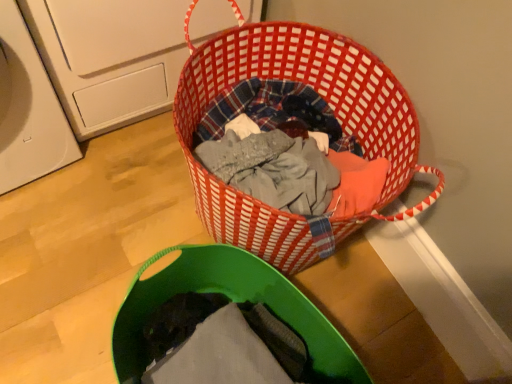
Question: From their relative heights in the image, would you say green fabric laundry basket at lower center is taller or shorter than red woven basket at center?

Choices:
 (A) tall
 (B) short

Answer: (B)

Question: Visually, is green fabric laundry basket at lower center positioned to the left or to the right of red woven basket at center?

Choices:
 (A) right
 (B) left

Answer: (B)

Question: Which object is the farthest from the red woven basket at center?

Choices:
 (A) green fabric laundry basket at lower center
 (B) white plastic washing machine at left

Answer: (B)

Question: Estimate the real-world distances between objects in this image. Which object is farther from the red woven basket at center?

Choices:
 (A) green fabric laundry basket at lower center
 (B) white plastic washing machine at left

Answer: (B)